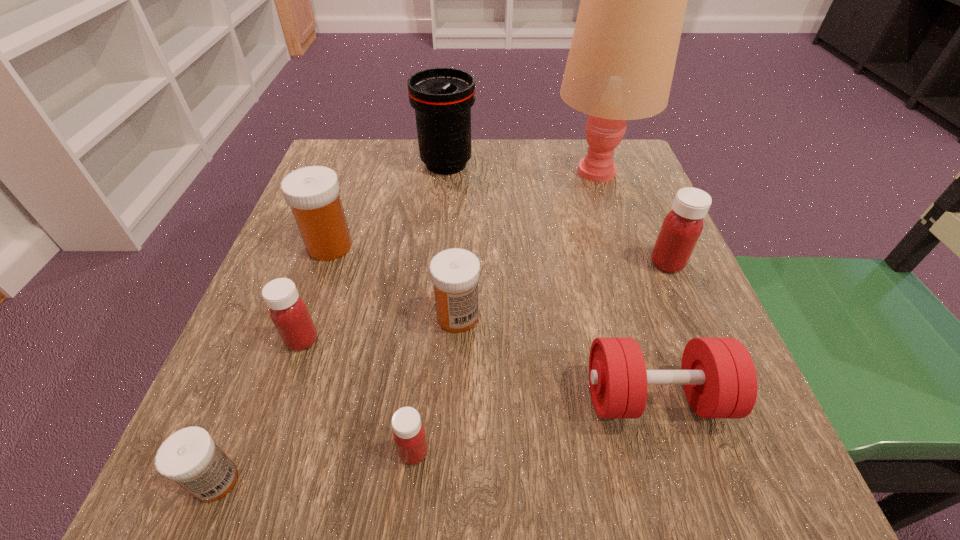
Locate an element on the screen. Image resolution: width=960 pixels, height=540 pixels. empty location between the black telephoto lens and the seventh farthest object is located at coordinates (551, 280).

At what (x,y) coordinates should I click in order to perform the action: click on free space between the third nearest object and the second red medicine from left to right. Please return your answer as a coordinate pair (x, y). The height and width of the screenshot is (540, 960). Looking at the image, I should click on (535, 424).

Find the location of a particular element. The height and width of the screenshot is (540, 960). free space between the rightmost white medicine and the biggest red medicine is located at coordinates (563, 290).

Where is `free space between the third nearest object and the eighth shortest object`? Image resolution: width=960 pixels, height=540 pixels. free space between the third nearest object and the eighth shortest object is located at coordinates (551, 280).

The height and width of the screenshot is (540, 960). Find the location of `free space between the smallest white medicine and the second red medicine from left to right`. free space between the smallest white medicine and the second red medicine from left to right is located at coordinates (315, 467).

This screenshot has height=540, width=960. I want to click on unoccupied area between the smallest white medicine and the seventh farthest object, so click(x=436, y=439).

I want to click on free point between the second nearest white medicine and the farthest white medicine, so click(394, 281).

Locate which object is the closest to the black telephoto lens. Please provide its 2D coordinates. Your answer should be formatted as a tuple, i.e. [(x, y)], where the tuple contains the x and y coordinates of a point satisfying the conditions above.

[(620, 66)]

Where is `object that is the second closest to the third nearest object`? object that is the second closest to the third nearest object is located at coordinates (681, 228).

Where is `medicine that is the second closest to the dumbbell`? medicine that is the second closest to the dumbbell is located at coordinates (681, 228).